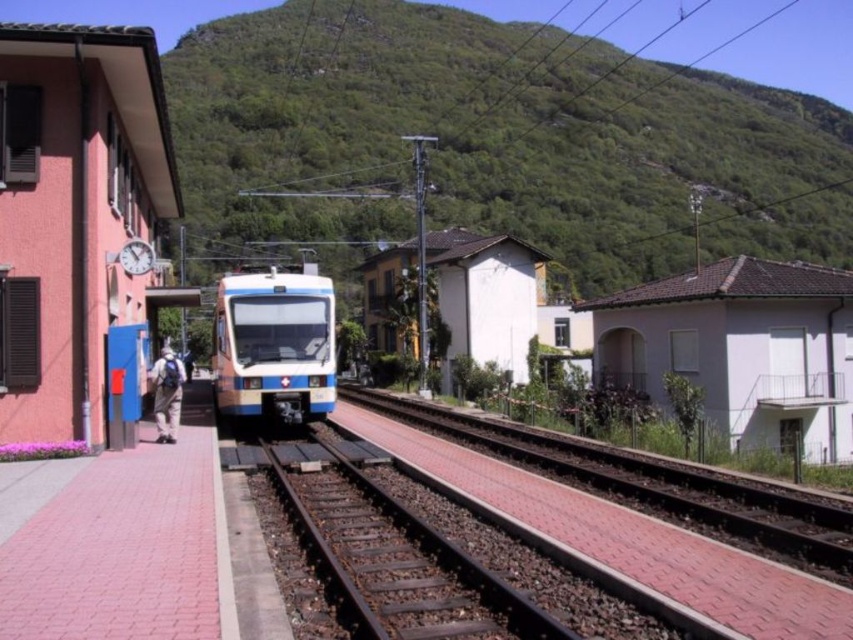
Between green leafy hillside at upper center and khaki pants at left, which one appears on the right side from the viewer's perspective?

green leafy hillside at upper center

Based on the photo, is green leafy hillside at upper center above khaki pants at left?

Indeed, green leafy hillside at upper center is positioned over khaki pants at left.

Is point (305, 225) positioned before point (167, 413)?

No, (305, 225) is further to viewer.

This screenshot has height=640, width=853. In order to click on green leafy hillside at upper center in this screenshot , I will do `click(498, 140)`.

Describe the element at coordinates (498, 140) in the screenshot. I see `green leafy hillside at upper center` at that location.

Find the location of a particular element. green leafy hillside at upper center is located at coordinates (498, 140).

Who is taller, blue glossy train at center or khaki pants at left?

blue glossy train at center is taller.

Where is `blue glossy train at center`? blue glossy train at center is located at coordinates point(274,346).